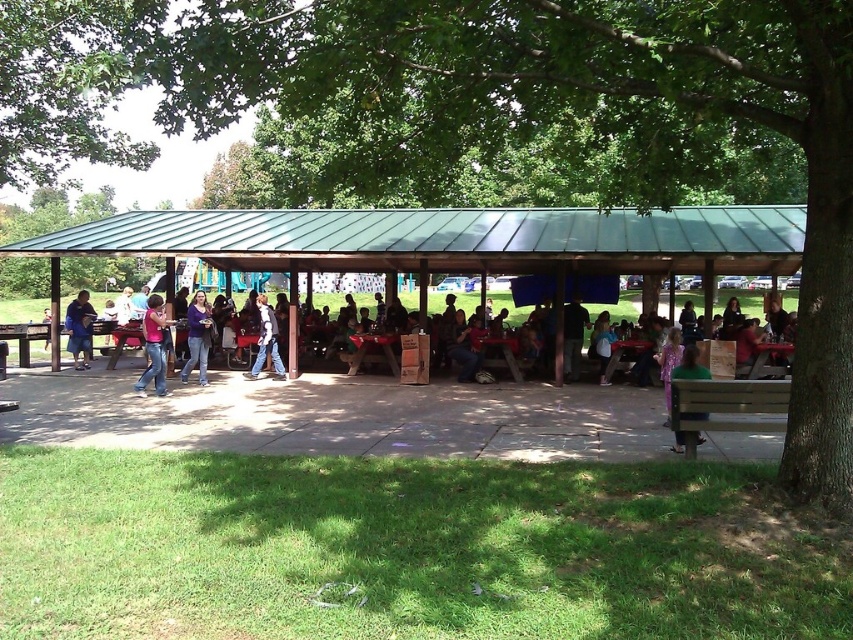
You are standing at the center of the pavilion and want to sit down on the wooden park bench at lower right. Which direction should you walk to reach it?

You should walk towards the lower right direction to reach the wooden park bench at lower right.

You are at the park and see the wooden park bench at lower right and the green matte shirt at lower right. Which object is positioned more to the right side?

The wooden park bench at lower right is positioned more to the right side than the green matte shirt at lower right.